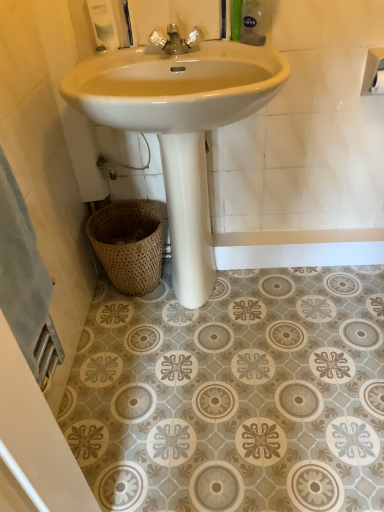
Question: Considering the relative positions of white glossy sink at center and white matte toilet paper at upper right, the second toilet paper in the back-to-front sequence, in the image provided, is white glossy sink at center to the left or to the right of white matte toilet paper at upper right, the second toilet paper in the back-to-front sequence,?

Choices:
 (A) right
 (B) left

Answer: (B)

Question: Is white glossy sink at center taller or shorter than white matte toilet paper at upper right, which ranks as the first toilet paper in front-to-back order?

Choices:
 (A) short
 (B) tall

Answer: (B)

Question: Which object is positioned farthest from the white matte toilet paper at upper right, which ranks as the first toilet paper in front-to-back order?

Choices:
 (A) white glossy sink at center
 (B) woven natural basket at lower left
 (C) green plastic bottle at upper right, the second toiletry when ordered from left to right
 (D) white glossy soap dispenser at upper left, the second toiletry viewed from the right
 (E) white matte toilet paper at upper right, the 2th toilet paper viewed from the front

Answer: (B)

Question: Which of these objects is positioned farthest from the white glossy soap dispenser at upper left, the second toiletry viewed from the right?

Choices:
 (A) white glossy sink at center
 (B) woven natural basket at lower left
 (C) chrome metallic faucet at center
 (D) white matte toilet paper at upper right, the 2th toilet paper viewed from the front
 (E) green plastic bottle at upper right, the first toiletry when ordered from right to left

Answer: (D)